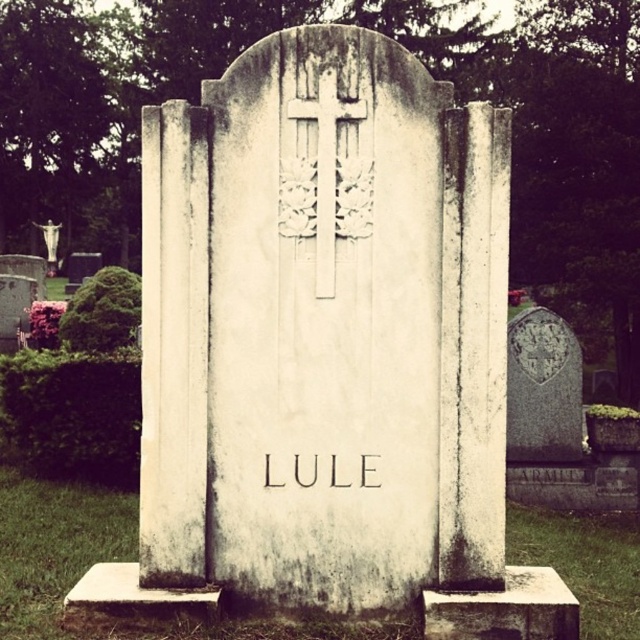
Question: Does white marble gravestone at center appear over white stone cross at upper center?

Choices:
 (A) no
 (B) yes

Answer: (A)

Question: Based on their relative distances, which object is farther from the white stone cross at upper center?

Choices:
 (A) white marble gravestone at center
 (B) white carved wood cross at center

Answer: (A)

Question: Which object appears closest to the camera in this image?

Choices:
 (A) white marble gravestone at center
 (B) white carved wood cross at center

Answer: (A)

Question: Can you confirm if white marble gravestone at center is positioned below white carved wood cross at center?

Choices:
 (A) no
 (B) yes

Answer: (B)

Question: Which is nearer to the white marble gravestone at center?

Choices:
 (A) white stone cross at upper center
 (B) white carved wood cross at center

Answer: (B)

Question: Is white marble gravestone at center further to the viewer compared to white carved wood cross at center?

Choices:
 (A) no
 (B) yes

Answer: (A)